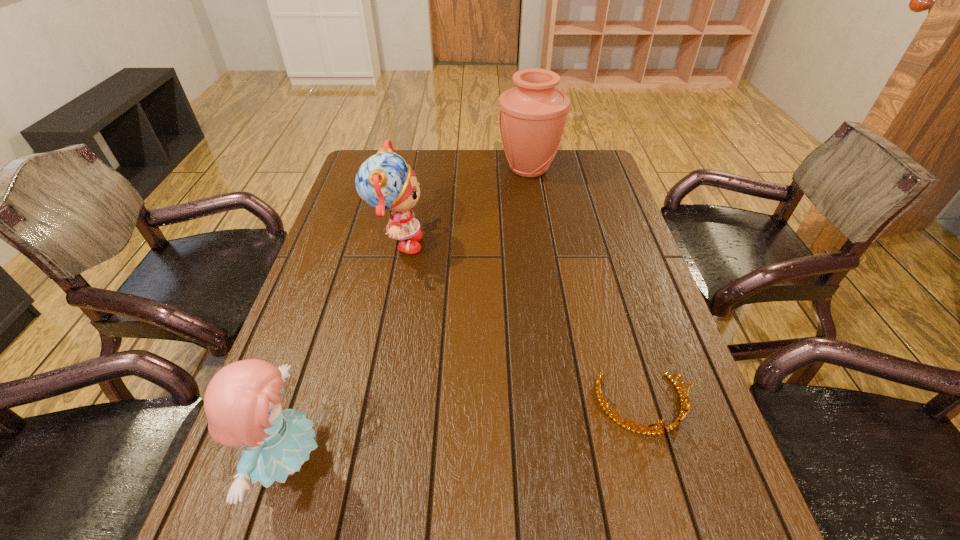
Find the location of a particular element. the farthest object is located at coordinates (532, 116).

Locate an element on the screen. the farther doll is located at coordinates (384, 181).

Where is `the nearer doll`? This screenshot has width=960, height=540. the nearer doll is located at coordinates (242, 403).

Locate an element on the screen. tiara is located at coordinates (648, 430).

This screenshot has width=960, height=540. What are the coordinates of `vacant space located on the left of the vase` in the screenshot? It's located at pos(399,169).

Where is `vacant space situated 0.350m on the face of the farther doll`? The width and height of the screenshot is (960, 540). vacant space situated 0.350m on the face of the farther doll is located at coordinates (546, 245).

The width and height of the screenshot is (960, 540). What are the coordinates of `vacant space located 0.260m on the front-facing side of the nearer doll` in the screenshot? It's located at pos(465,461).

The image size is (960, 540). Identify the location of vacant space located 0.150m on the front-facing side of the shortest object. (677, 526).

Locate an element on the screen. The image size is (960, 540). object located in the far edge section of the desktop is located at coordinates (532, 116).

The image size is (960, 540). I want to click on object that is at the near edge, so click(242, 403).